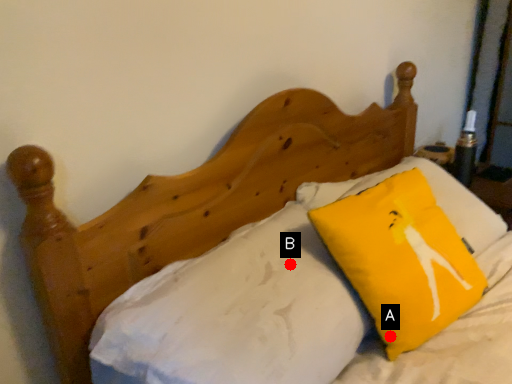
Question: Two points are circled on the image, labeled by A and B beside each circle. Which point is farther from the camera taking this photo?

Choices:
 (A) A is further
 (B) B is further

Answer: (B)